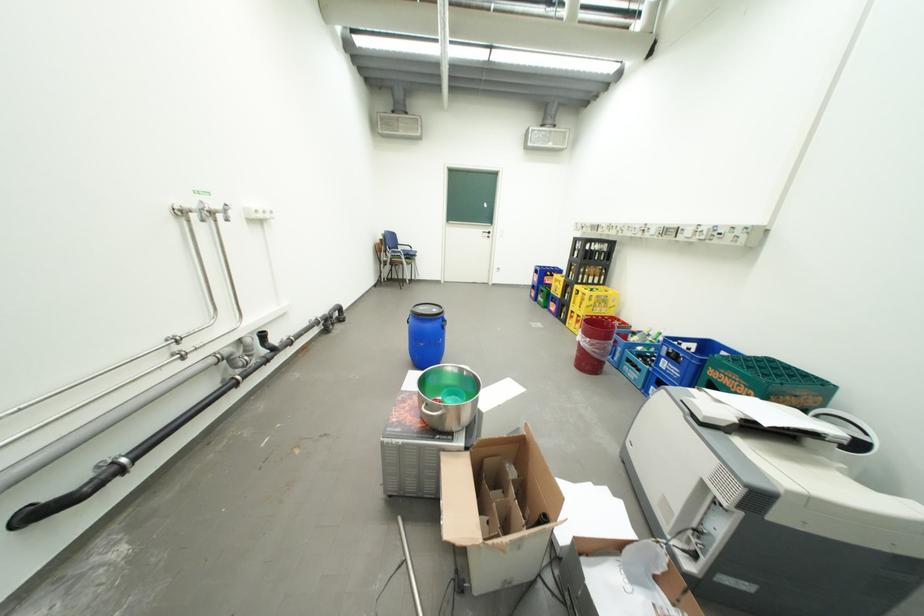
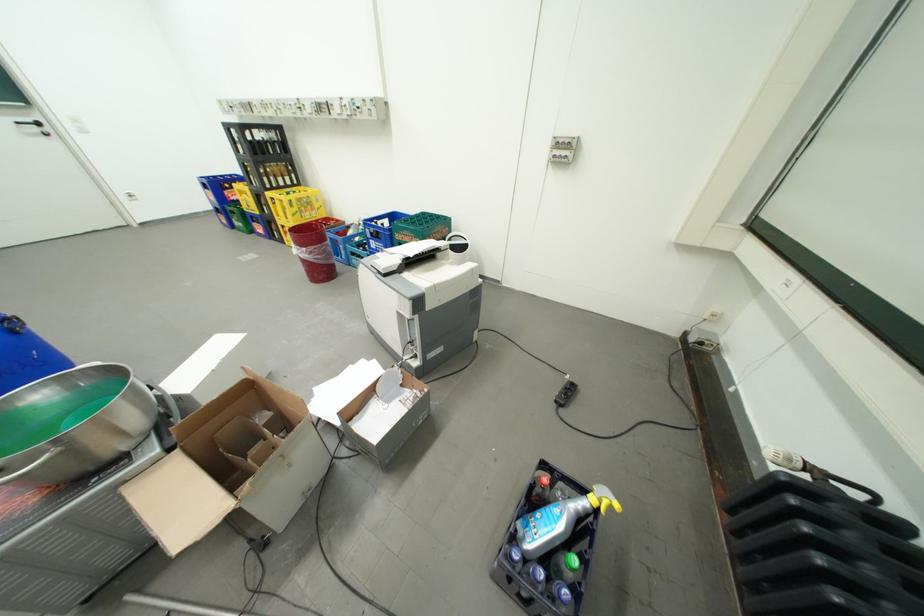
Find the pixel in the second image that matches point 497,233 in the first image.

(41, 122)